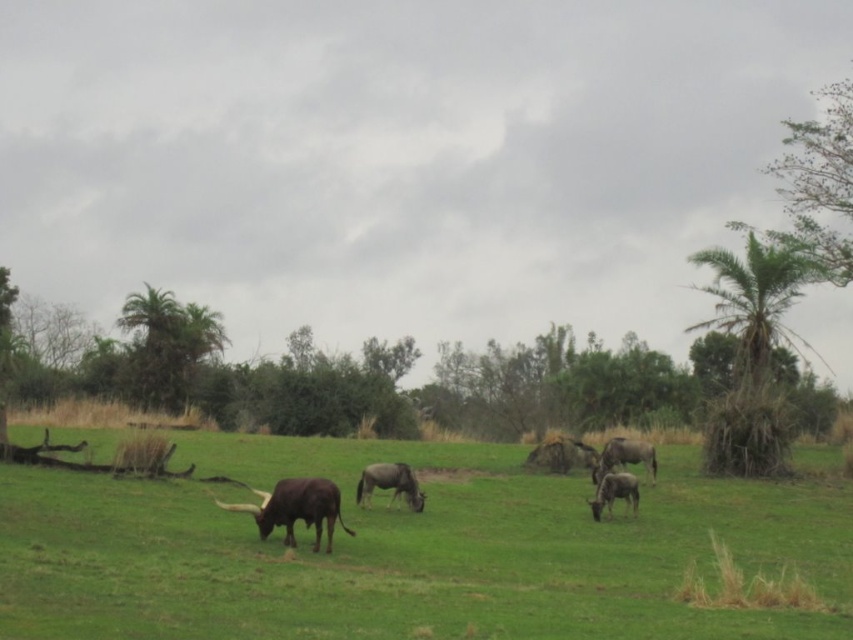
You are a photographer positioned in the savanna and want to capture both the green grass pasture at center and the brown glossy buffalo at lower left in a single shot. Which object will appear larger in your photo?

The green grass pasture at center will appear larger in the photo because it is closer to the viewer than the brown glossy buffalo at lower left.